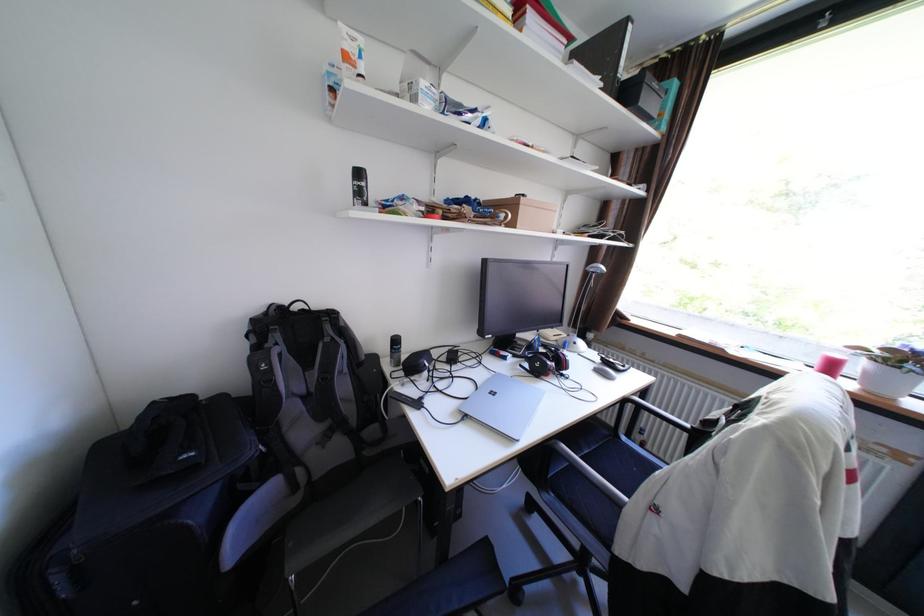
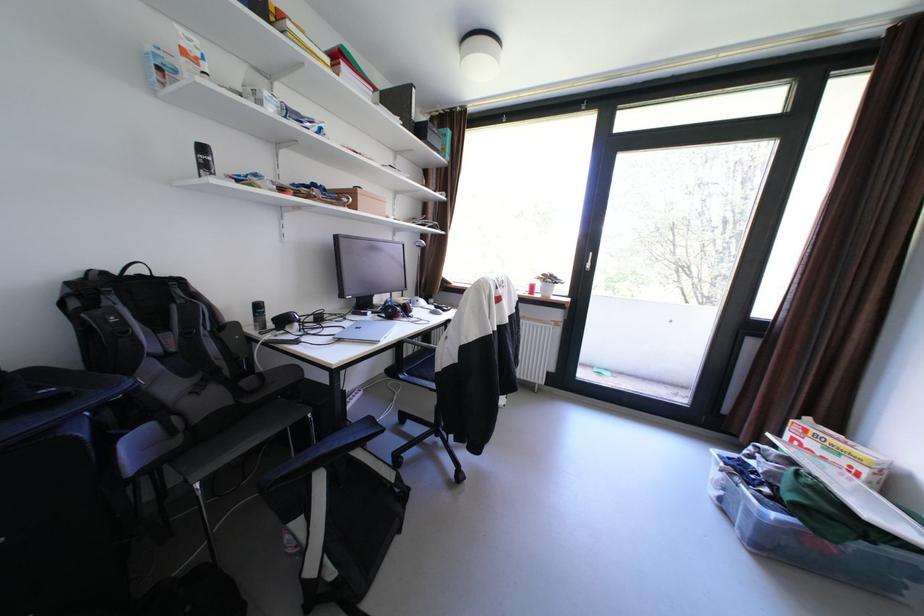
Find the pixel in the second image that matches pixel 520 357 in the first image.

(380, 313)